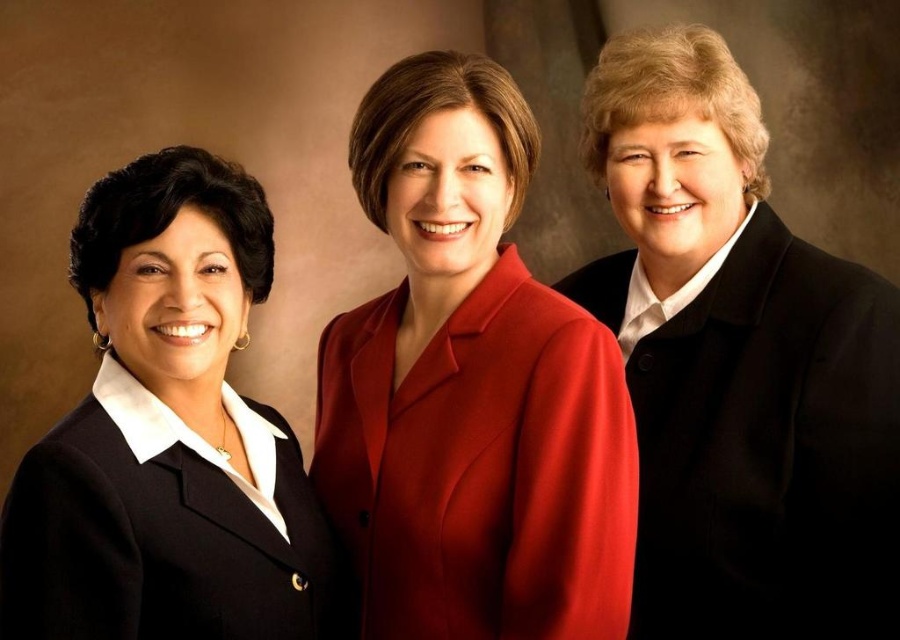
Question: Estimate the real-world distances between objects in this image. Which object is closer to the matte black blazer at left?

Choices:
 (A) black woolen jacket at right
 (B) matte red blazer at center

Answer: (B)

Question: Among these objects, which one is nearest to the camera?

Choices:
 (A) matte red blazer at center
 (B) black woolen jacket at right
 (C) matte black blazer at left

Answer: (C)

Question: Considering the relative positions of matte black blazer at left and black woolen jacket at right in the image provided, where is matte black blazer at left located with respect to black woolen jacket at right?

Choices:
 (A) below
 (B) above

Answer: (B)

Question: Observing the image, what is the correct spatial positioning of matte red blazer at center in reference to black woolen jacket at right?

Choices:
 (A) left
 (B) right

Answer: (A)

Question: Considering the real-world distances, which object is closest to the black woolen jacket at right?

Choices:
 (A) matte red blazer at center
 (B) matte black blazer at left

Answer: (A)

Question: Is matte black blazer at left below black woolen jacket at right?

Choices:
 (A) yes
 (B) no

Answer: (B)